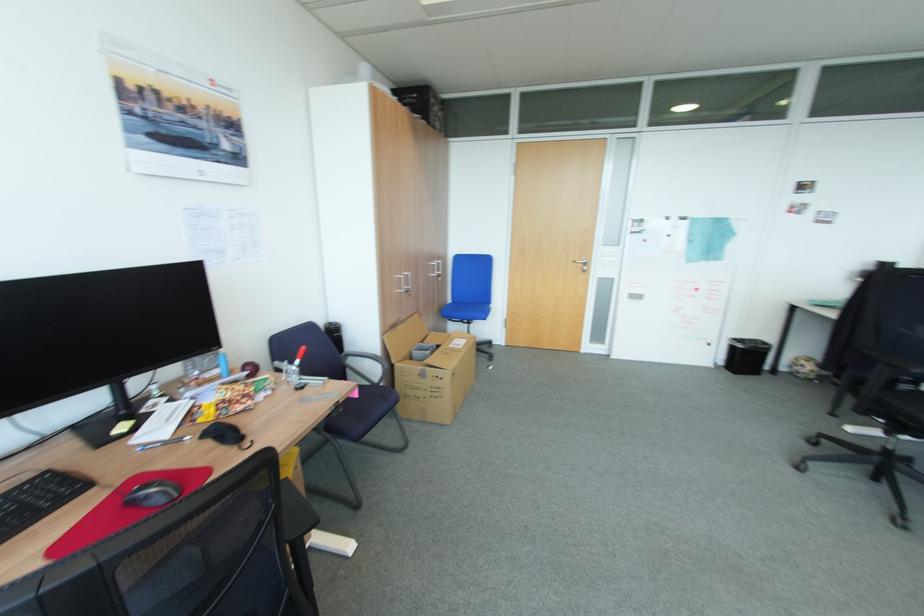
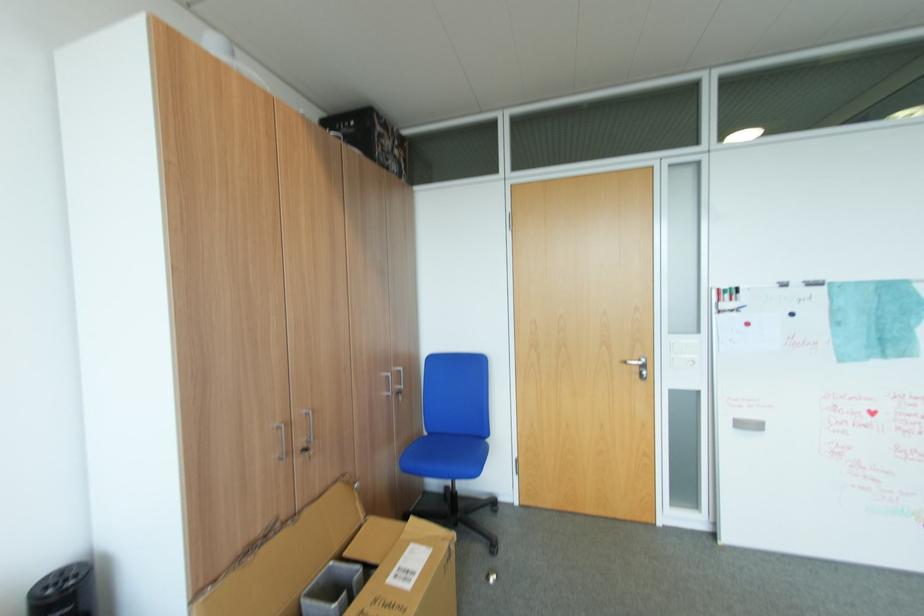
Question: Which direction would the cameraman need to move to produce the second image? Reply with the corresponding letter.

Choices:
 (A) Left
 (B) Right
 (C) Forward
 (D) Backward

Answer: (C)